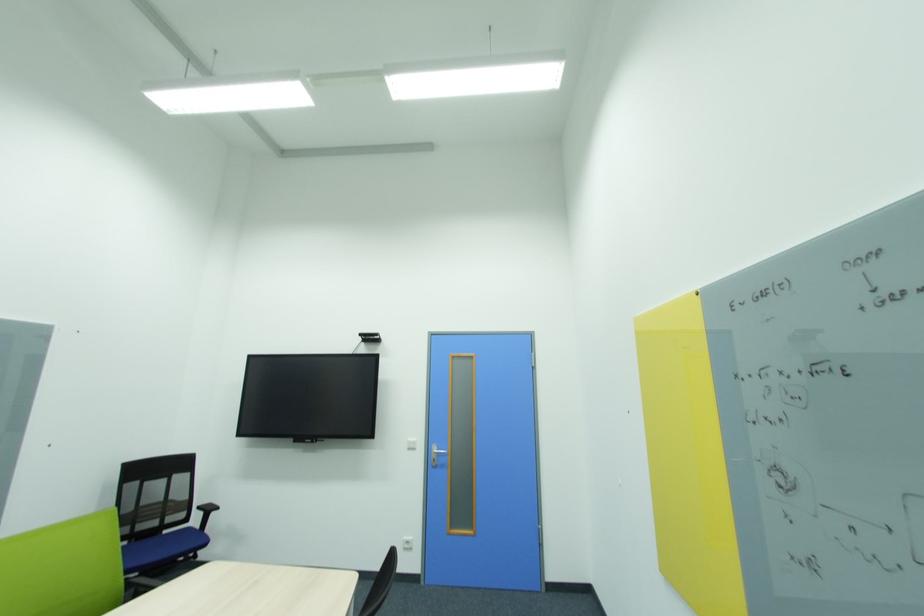
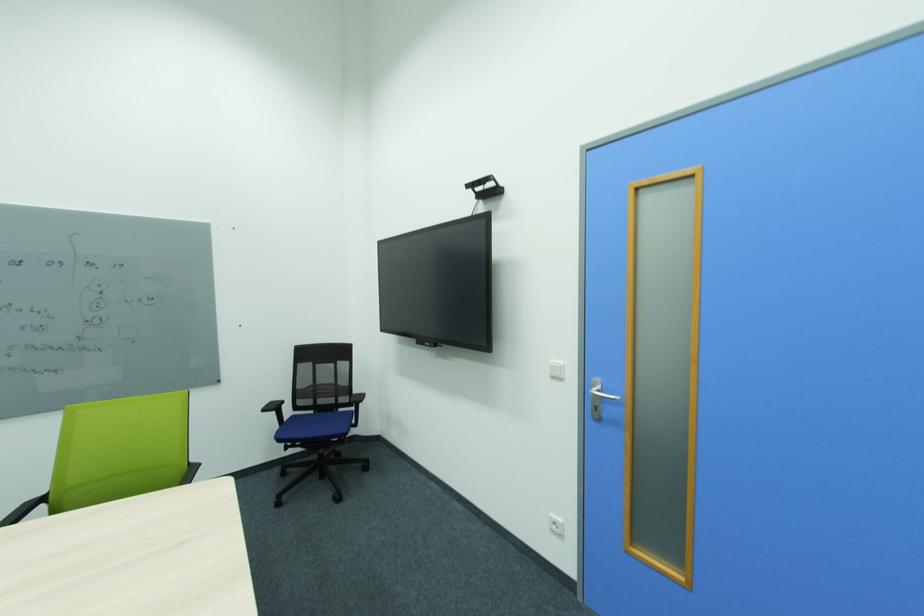
Locate, in the second image, the point that corresponds to pixel 412 544 in the first image.

(560, 525)